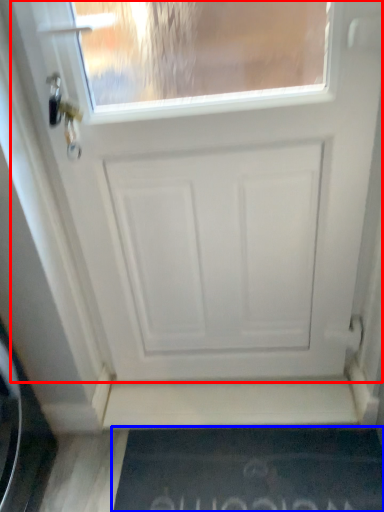
Question: Which object appears farthest to the camera in this image, door (highlighted by a red box) or doormat (highlighted by a blue box)?

Choices:
 (A) door
 (B) doormat

Answer: (B)